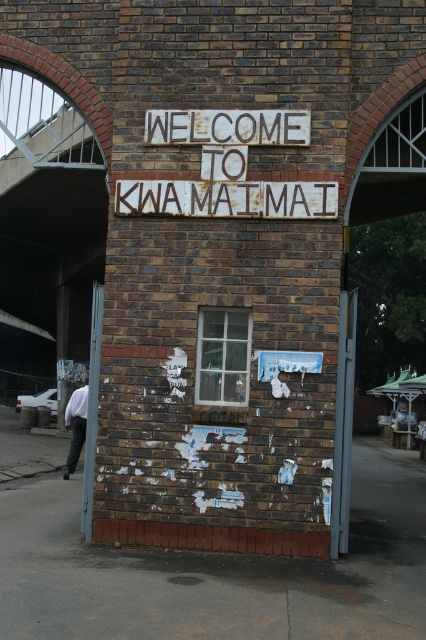
You are standing in front of the brick building with the sign. There are two points marked on the wall. One is at coordinate point (253, 204) and the other is at point (92, 492). Which point is closer to you?

Point (253, 204) is closer to the camera than point (92, 492), so the point at (253, 204) is closer to you.

You are standing in front of the brick building and want to determine the relative positions of two points marked on the wall. Which point, point [255,132] or point [77,428], is closer to you?

Point [255,132] is closer to the camera than point [77,428], so it is closer to you.